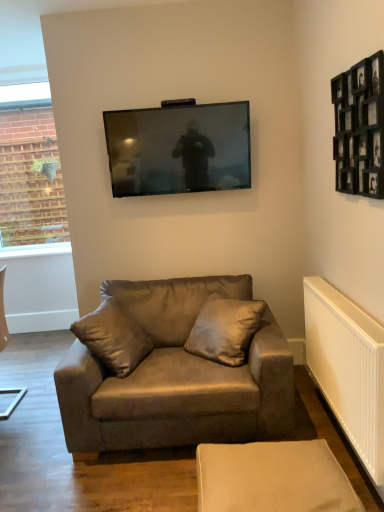
In order to face beige fabric ottoman at lower center, should I rotate leftwards or rightwards?

You should rotate right by 10.116 degrees.

This screenshot has width=384, height=512. What do you see at coordinates (348, 369) in the screenshot?
I see `white plastic radiator at lower right` at bounding box center [348, 369].

The image size is (384, 512). In order to click on black wooden picture frame at upper right in this screenshot , I will do `click(360, 128)`.

Find the location of a particular element. The width and height of the screenshot is (384, 512). suede brown couch at center is located at coordinates (177, 377).

The height and width of the screenshot is (512, 384). In the image, there is a suede brown couch at center. Identify the location of radiator below it (from the image's perspective). (348, 369).

Can you confirm if suede brown couch at center is shorter than white plastic radiator at lower right?

In fact, suede brown couch at center may be taller than white plastic radiator at lower right.

Is suede brown couch at center aimed at white plastic radiator at lower right?

No, suede brown couch at center is not aimed at white plastic radiator at lower right.

How many degrees apart are the facing directions of suede brown couch at center and white plastic radiator at lower right?

The facing directions of suede brown couch at center and white plastic radiator at lower right are 87.7 degrees apart.

From a real-world perspective, is suede brown couch at center over black wooden picture frame at upper right?

Actually, suede brown couch at center is physically below black wooden picture frame at upper right in the real world.

Is suede brown couch at center wider than black wooden picture frame at upper right?

Yes, suede brown couch at center is wider than black wooden picture frame at upper right.

From the image's perspective, is suede brown couch at center located above or below black wooden picture frame at upper right?

Clearly, from the image's perspective, suede brown couch at center is below black wooden picture frame at upper right.

Does beige fabric ottoman at lower center have a lesser height compared to matte black tv at upper center?

Yes.

Visually, is beige fabric ottoman at lower center positioned to the left or to the right of matte black tv at upper center?

beige fabric ottoman at lower center is positioned on matte black tv at upper center's right side.

Which object is thinner, beige fabric ottoman at lower center or matte black tv at upper center?

matte black tv at upper center.

From the image's perspective, is beige fabric ottoman at lower center beneath matte black tv at upper center?

Indeed, from the image's perspective, beige fabric ottoman at lower center is shown beneath matte black tv at upper center.

Are suede brown couch at center and beige fabric ottoman at lower center located far from each other?

suede brown couch at center is actually quite close to beige fabric ottoman at lower center.

Is suede brown couch at center shorter than beige fabric ottoman at lower center?

In fact, suede brown couch at center may be taller than beige fabric ottoman at lower center.

Is suede brown couch at center facing towards beige fabric ottoman at lower center?

Yes, suede brown couch at center is oriented towards beige fabric ottoman at lower center.

Is suede brown couch at center in front of or behind beige fabric ottoman at lower center in the image?

In the image, suede brown couch at center appears behind beige fabric ottoman at lower center.

Looking at the image, does black wooden picture frame at upper right seem bigger or smaller compared to white plastic radiator at lower right?

Considering their sizes, black wooden picture frame at upper right takes up more space than white plastic radiator at lower right.

Is point (373, 96) more distant than point (323, 362)?

No, (373, 96) is in front of (323, 362).

Are black wooden picture frame at upper right and white plastic radiator at lower right making contact?

No, black wooden picture frame at upper right is not next to white plastic radiator at lower right.

From the image's perspective, is black wooden picture frame at upper right over white plastic radiator at lower right?

Yes, from the image's perspective, black wooden picture frame at upper right is on top of white plastic radiator at lower right.

From a real-world perspective, which is physically above, suede-like beige pillow at center or white plastic radiator at lower right?

suede-like beige pillow at center is physically above.

Identify the location of pillow lying on the left of white plastic radiator at lower right. Image resolution: width=384 pixels, height=512 pixels. (225, 329).

Which of these two, suede-like beige pillow at center or white plastic radiator at lower right, is thinner?

white plastic radiator at lower right.

Is suede-like beige pillow at center inside the boundaries of white plastic radiator at lower right, or outside?

suede-like beige pillow at center is outside white plastic radiator at lower right.

Does beige fabric ottoman at lower center have a lesser height compared to suede-like beige pillow at center?

Yes, beige fabric ottoman at lower center is shorter than suede-like beige pillow at center.

Is beige fabric ottoman at lower center at the left side of suede-like beige pillow at center?

In fact, beige fabric ottoman at lower center is to the right of suede-like beige pillow at center.

Is point (327, 473) less distant than point (211, 331)?

Yes, it is in front of point (211, 331).

Considering the sizes of objects beige fabric ottoman at lower center and suede-like beige pillow at center in the image provided, who is bigger, beige fabric ottoman at lower center or suede-like beige pillow at center?

With larger size is suede-like beige pillow at center.

The image size is (384, 512). What are the coordinates of `radiator beneath the suede brown couch at center (from a real-world perspective)` in the screenshot? It's located at coord(348,369).

Identify the location of studio couch that is on the left side of black wooden picture frame at upper right. The width and height of the screenshot is (384, 512). (177, 377).

When comparing their distances from white plastic radiator at lower right, does beige fabric ottoman at lower center or suede-like beige pillow at center seem further?

suede-like beige pillow at center lies further to white plastic radiator at lower right than the other object.

Looking at the image, which one is located further to white plastic radiator at lower right, black wooden picture frame at upper right or suede-like beige pillow at center?

Among the two, black wooden picture frame at upper right is located further to white plastic radiator at lower right.

Considering their positions, is white plastic radiator at lower right positioned further to beige fabric ottoman at lower center than matte black tv at upper center?

Based on the image, matte black tv at upper center appears to be further to beige fabric ottoman at lower center.

From the image, which object appears to be farther from suede brown couch at center, white plastic radiator at lower right or suede-like beige pillow at center?

white plastic radiator at lower right is further to suede brown couch at center.

When comparing their distances from suede brown couch at center, does beige fabric ottoman at lower center or suede-like beige pillow at center seem further?

Among the two, beige fabric ottoman at lower center is located further to suede brown couch at center.

Which object lies further to the anchor point suede-like beige pillow at center, white plastic radiator at lower right or beige fabric ottoman at lower center?

Based on the image, beige fabric ottoman at lower center appears to be further to suede-like beige pillow at center.

In the scene shown: Looking at the image, which one is located closer to suede brown couch at center, beige fabric ottoman at lower center or matte black tv at upper center?

beige fabric ottoman at lower center lies closer to suede brown couch at center than the other object.

Based on their spatial positions, is beige fabric ottoman at lower center or matte black tv at upper center further from white plastic radiator at lower right?

matte black tv at upper center lies further to white plastic radiator at lower right than the other object.

At what (x,y) coordinates should I click in order to perform the action: click on radiator between black wooden picture frame at upper right and beige fabric ottoman at lower center in the up-down direction. Please return your answer as a coordinate pair (x, y). The height and width of the screenshot is (512, 384). Looking at the image, I should click on (348, 369).

Identify the location of pillow between matte black tv at upper center and beige fabric ottoman at lower center vertically. Image resolution: width=384 pixels, height=512 pixels. (225, 329).

Locate an element on the screen. pillow between matte black tv at upper center and white plastic radiator at lower right vertically is located at coordinates (x=225, y=329).

This screenshot has height=512, width=384. Identify the location of picture frame that lies between matte black tv at upper center and suede-like beige pillow at center from top to bottom. (360, 128).